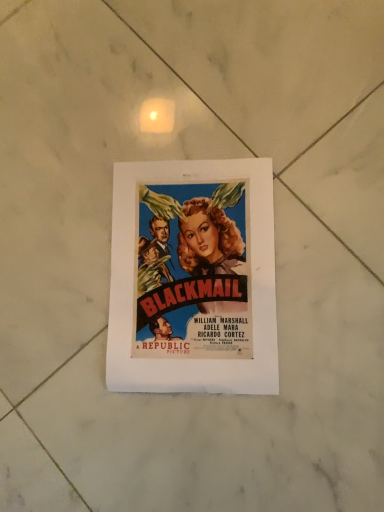
Identify the location of vacant point above matte paper poster at center (from a real-world perspective). This screenshot has height=512, width=384. (193, 274).